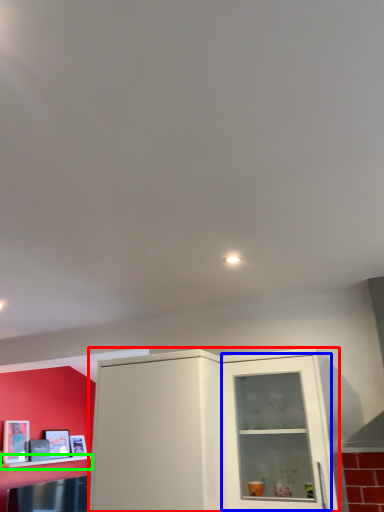
Question: Estimate the real-world distances between objects in this image. Which object is farther from cabinetry (highlighted by a red box), glass door (highlighted by a blue box) or shelf (highlighted by a green box)?

Choices:
 (A) glass door
 (B) shelf

Answer: (B)